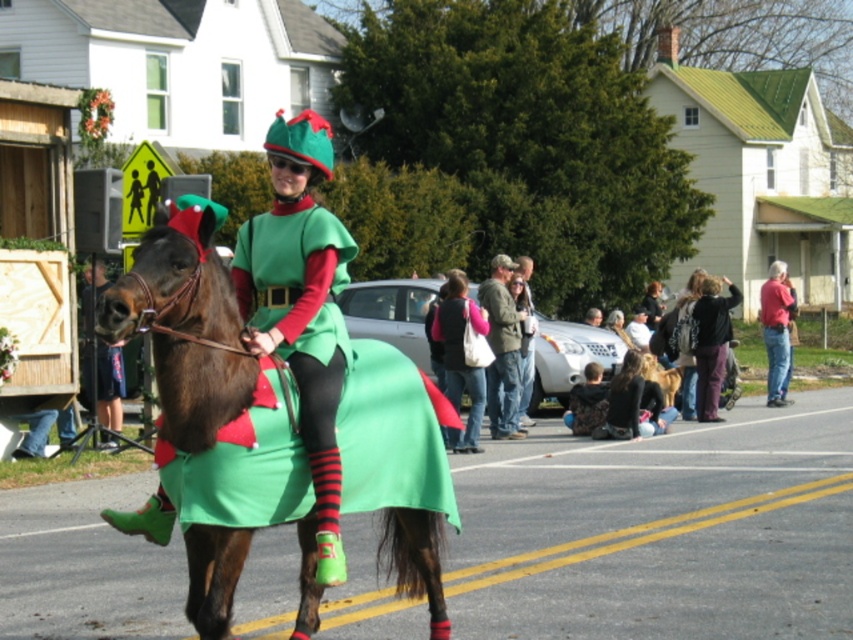
From the picture: How distant is shiny brown horse at center from denim jacket at center?

shiny brown horse at center is 9.05 meters away from denim jacket at center.

Can you confirm if shiny brown horse at center is positioned to the right of denim jacket at center?

In fact, shiny brown horse at center is to the left of denim jacket at center.

At what (x,y) coordinates should I click in order to perform the action: click on shiny brown horse at center. Please return your answer as a coordinate pair (x, y). Looking at the image, I should click on (213, 417).

Who is shorter, camouflage jacket at center or denim jacket at center?

Standing shorter between the two is denim jacket at center.

Does point (489, 339) come behind point (468, 413)?

No, it is in front of (468, 413).

The image size is (853, 640). I want to click on camouflage jacket at center, so click(x=502, y=349).

Does green matte dress at center come in front of denim jacket at center?

Yes, green matte dress at center is closer to the viewer.

Who is shorter, green matte dress at center or denim jacket at center?

Standing shorter between the two is green matte dress at center.

Is point (329, 515) positioned before point (479, 410)?

Yes, point (329, 515) is closer to viewer.

Where is `green matte dress at center`? green matte dress at center is located at coordinates (300, 321).